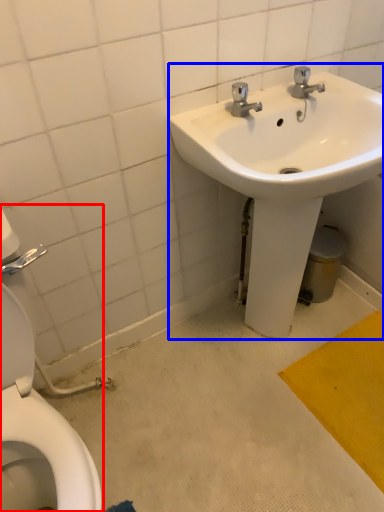
Question: Which object is closer to the camera taking this photo, toilet (highlighted by a red box) or sink (highlighted by a blue box)?

Choices:
 (A) toilet
 (B) sink

Answer: (A)